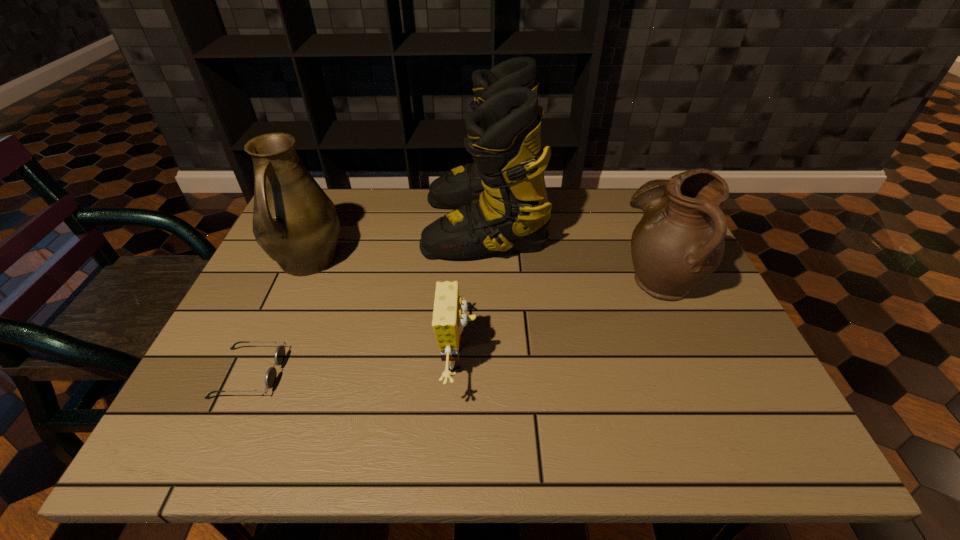
This screenshot has height=540, width=960. Find the location of `vacant region located 0.330m on the face of the second shortest object`. vacant region located 0.330m on the face of the second shortest object is located at coordinates (631, 361).

The image size is (960, 540). Find the location of `free space located on the front-facing side of the sunglasses`. free space located on the front-facing side of the sunglasses is located at coordinates (400, 373).

Locate an element on the screen. Image resolution: width=960 pixels, height=540 pixels. object that is at the far edge is located at coordinates (501, 201).

Where is `object that is at the near edge`? object that is at the near edge is located at coordinates (449, 315).

Where is `pitcher present at the left edge`? pitcher present at the left edge is located at coordinates (294, 221).

Locate an element on the screen. The height and width of the screenshot is (540, 960). sunglasses located at the left edge is located at coordinates (270, 378).

Locate an element on the screen. This screenshot has height=540, width=960. object that is at the right edge is located at coordinates (679, 242).

Find the location of a particular element. vacant space at the far edge of the desktop is located at coordinates (423, 199).

Where is `free point at the near edge`? Image resolution: width=960 pixels, height=540 pixels. free point at the near edge is located at coordinates (305, 411).

Image resolution: width=960 pixels, height=540 pixels. I want to click on free region at the left edge of the desktop, so click(255, 313).